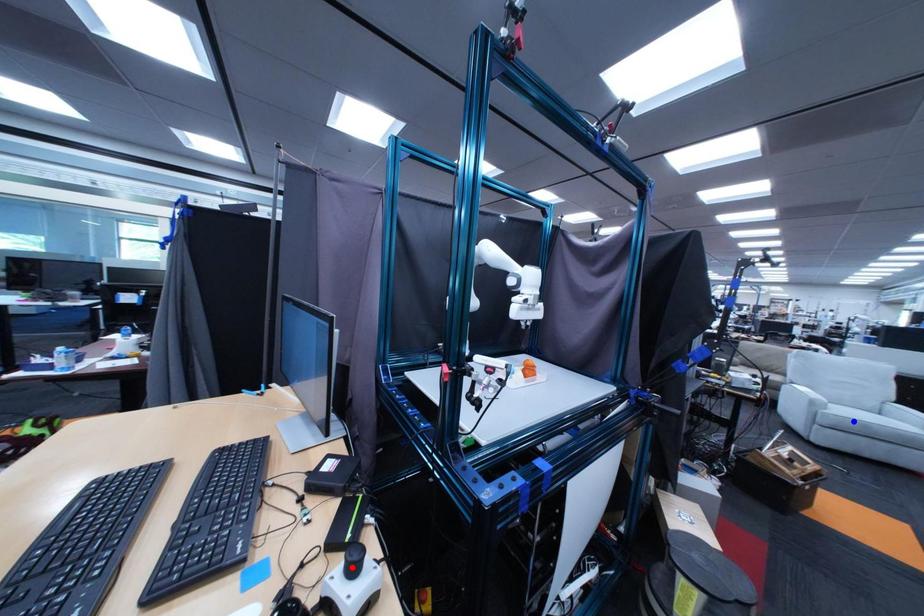
Question: In the image, two points are highlighted. Which point is nearer to the camera? Reply with the corresponding letter.

Choices:
 (A) blue point
 (B) red point

Answer: (B)